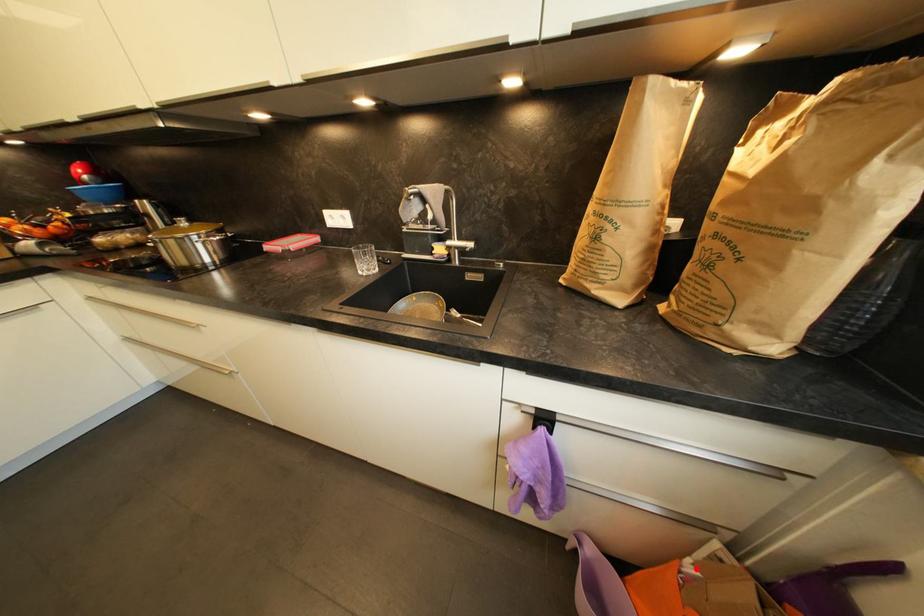
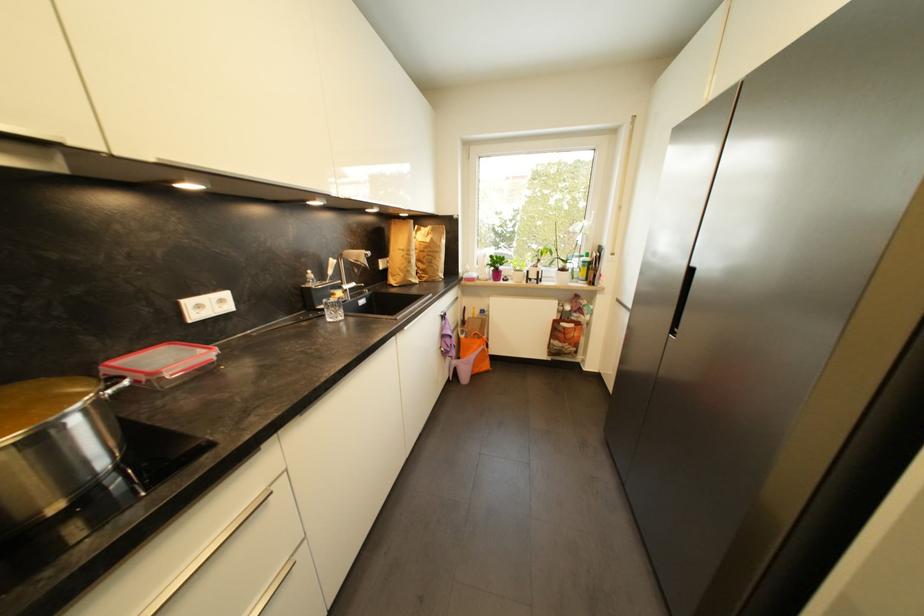
Where in the second image is the point corresponding to the highlighted location from the first image?

(468, 339)